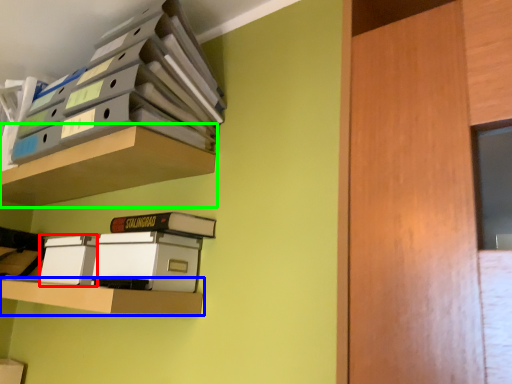
Question: Estimate the real-world distances between objects in this image. Which object is farther from storage box (highlighted by a red box), shelf (highlighted by a blue box) or shelf (highlighted by a green box)?

Choices:
 (A) shelf
 (B) shelf

Answer: (B)